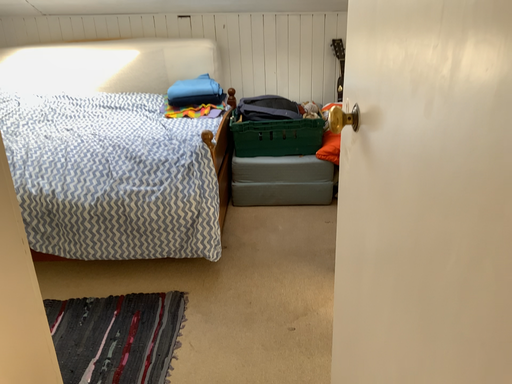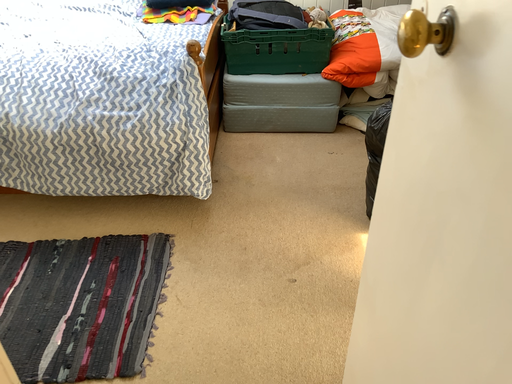
Question: How did the camera likely rotate when shooting the video?

Choices:
 (A) rotated downward
 (B) rotated upward

Answer: (A)